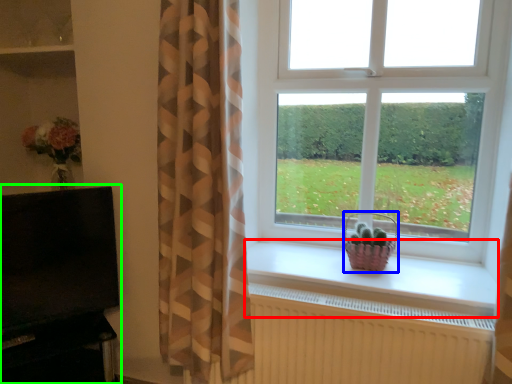
Question: Which is farther away from window sill (highlighted by a red box)? basket (highlighted by a blue box) or entertainment center (highlighted by a green box)?

Choices:
 (A) basket
 (B) entertainment center

Answer: (B)